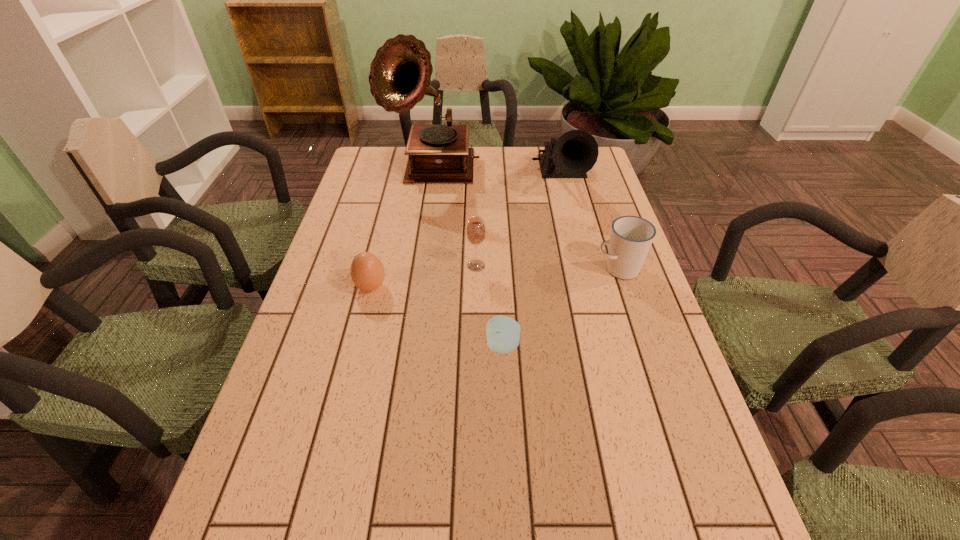
The height and width of the screenshot is (540, 960). I want to click on vacant region located 0.210m with a handle on the side of the cup, so [x=516, y=269].

Identify the location of free spot located with a handle on the side of the cup. (501, 269).

Find the location of `vacant position located 0.350m with a handle on the side of the cup`. vacant position located 0.350m with a handle on the side of the cup is located at coordinates (464, 269).

Find the location of `vacant space located 0.080m on the back of the boiled egg`. vacant space located 0.080m on the back of the boiled egg is located at coordinates (379, 255).

Where is `free space located 0.170m on the left of the shortest object`? free space located 0.170m on the left of the shortest object is located at coordinates (411, 346).

Identify the location of record player present at the far edge. (400, 74).

Find the location of a particular element. The image size is (960, 540). phonograph_record present at the far edge is located at coordinates (572, 155).

Locate an element on the screen. record player present at the left edge is located at coordinates (400, 74).

The height and width of the screenshot is (540, 960). Identify the location of boiled egg that is at the left edge. (367, 272).

You are a GUI agent. You are given a task and a screenshot of the screen. Output one action in this format:
    pyautogui.click(x=<x>, y=<y>)
    Task: Click on the phonograph_record present at the right edge
    The height and width of the screenshot is (540, 960).
    Given the screenshot: What is the action you would take?
    pyautogui.click(x=572, y=155)